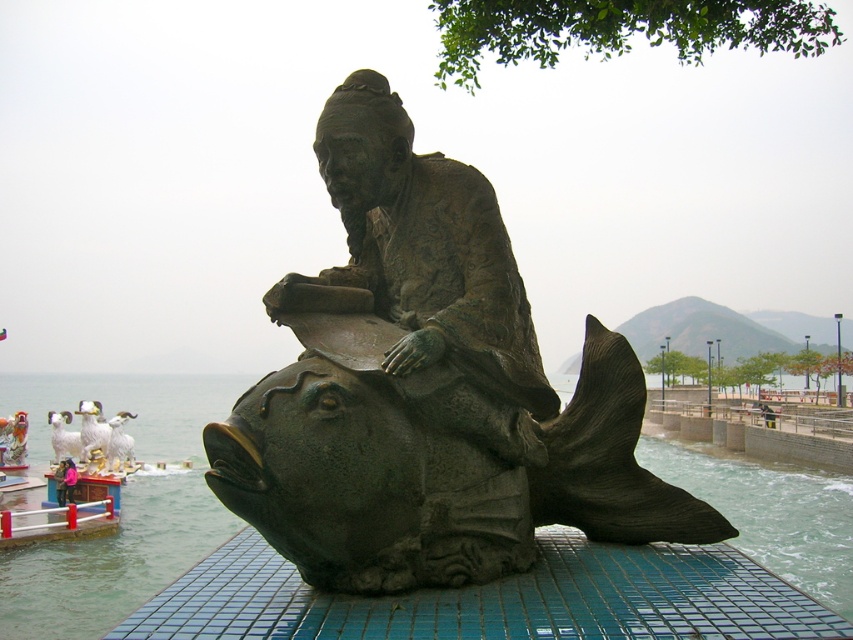
Question: Which object is closer to the camera taking this photo?

Choices:
 (A) bronze statue at center
 (B) bronze fish sculpture at center

Answer: (B)

Question: In this image, where is bronze statue at center located relative to bronze fish sculpture at center?

Choices:
 (A) above
 (B) below

Answer: (A)

Question: Does bronze statue at center have a larger size compared to bronze fish sculpture at center?

Choices:
 (A) no
 (B) yes

Answer: (A)

Question: Can you confirm if bronze statue at center is bigger than bronze fish sculpture at center?

Choices:
 (A) no
 (B) yes

Answer: (A)

Question: Which object appears closest to the camera in this image?

Choices:
 (A) bronze fish sculpture at center
 (B) bronze statue at center

Answer: (A)